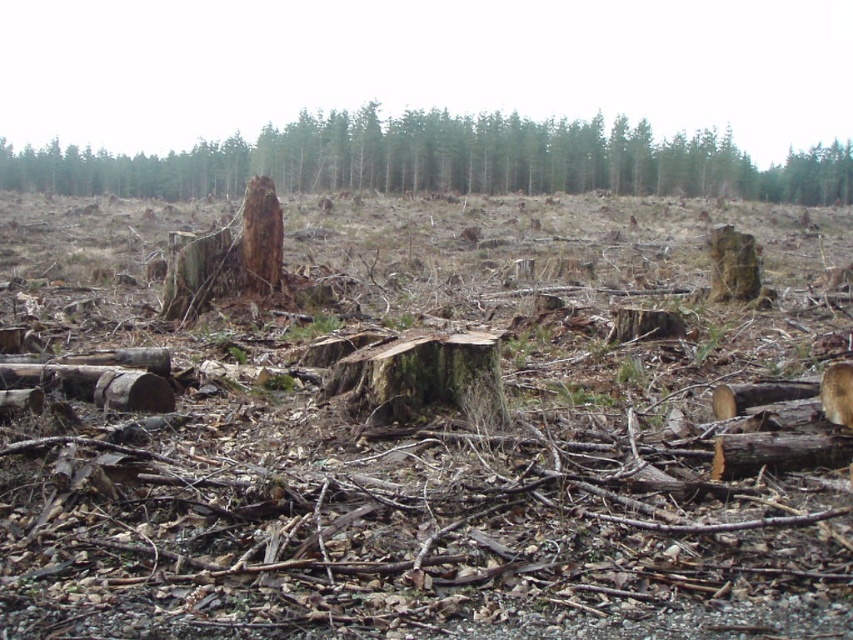
You are a forester assessing the deforested area. You notice the brown rough tree stump at center and the brown rough tree trunk at center. Which object is larger in size?

The brown rough tree stump at center is bigger than the brown rough tree trunk at center, so the stump is larger in size.

You are a drone operator flying over the deforested area. You need to land your drone at the point closest to you. Which point should you choose between point (x=186, y=152) and point (x=270, y=227)?

Point (x=270, y=227) is closer to you than point (x=186, y=152), so you should choose point (x=270, y=227) to land your drone.